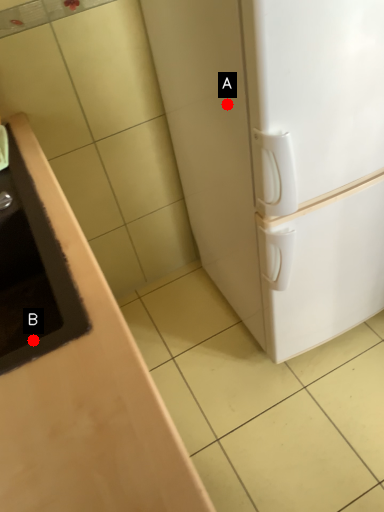
Question: Two points are circled on the image, labeled by A and B beside each circle. Which point appears farthest from the camera in this image?

Choices:
 (A) A is further
 (B) B is further

Answer: (A)